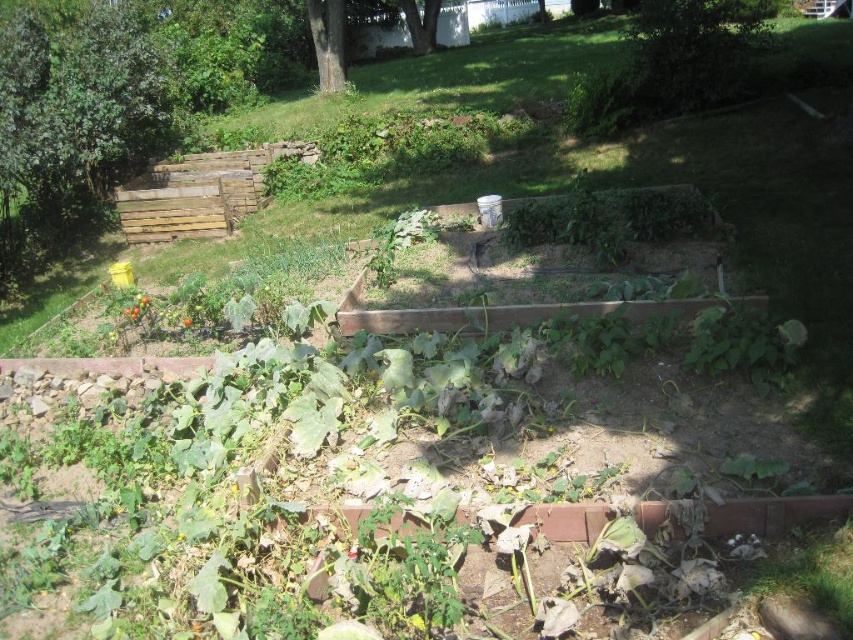
You are standing in the garden and want to take a photo of both the green rough bark tree at upper center and the green leafy tree at upper center. Which tree should you focus on first to ensure both are in clear view?

You should focus on the green rough bark tree at upper center first because it is closer to you than the green leafy tree at upper center. By focusing on the closer tree, both trees will be in clearer view as the farther one will still be within the depth of field.